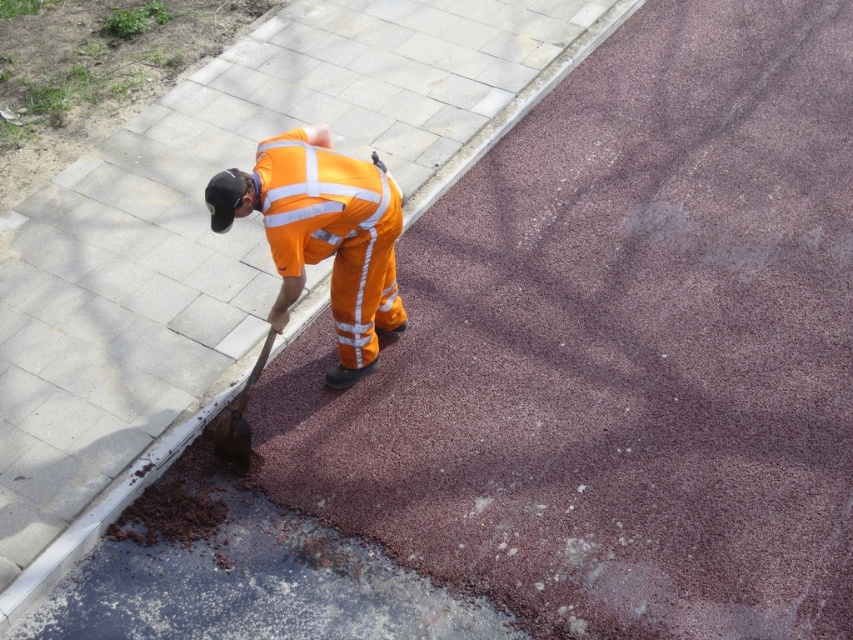
Question: Which object appears closest to the camera in this image?

Choices:
 (A) wooden shovel at lower center
 (B) high-visibility orange reflective jumpsuit at center
 (C) high-visibility fabric safety vest at center

Answer: (B)

Question: Is high-visibility orange reflective jumpsuit at center to the right of high-visibility fabric safety vest at center from the viewer's perspective?

Choices:
 (A) no
 (B) yes

Answer: (A)

Question: Which point is farther from the camera taking this photo?

Choices:
 (A) (231, 420)
 (B) (258, 168)
 (C) (340, 387)

Answer: (C)

Question: Does high-visibility orange reflective jumpsuit at center appear on the right side of wooden shovel at lower center?

Choices:
 (A) yes
 (B) no

Answer: (A)

Question: Which object is farther from the camera taking this photo?

Choices:
 (A) wooden shovel at lower center
 (B) high-visibility fabric safety vest at center
 (C) high-visibility orange reflective jumpsuit at center

Answer: (A)

Question: In this image, where is high-visibility fabric safety vest at center located relative to wooden shovel at lower center?

Choices:
 (A) left
 (B) right

Answer: (B)